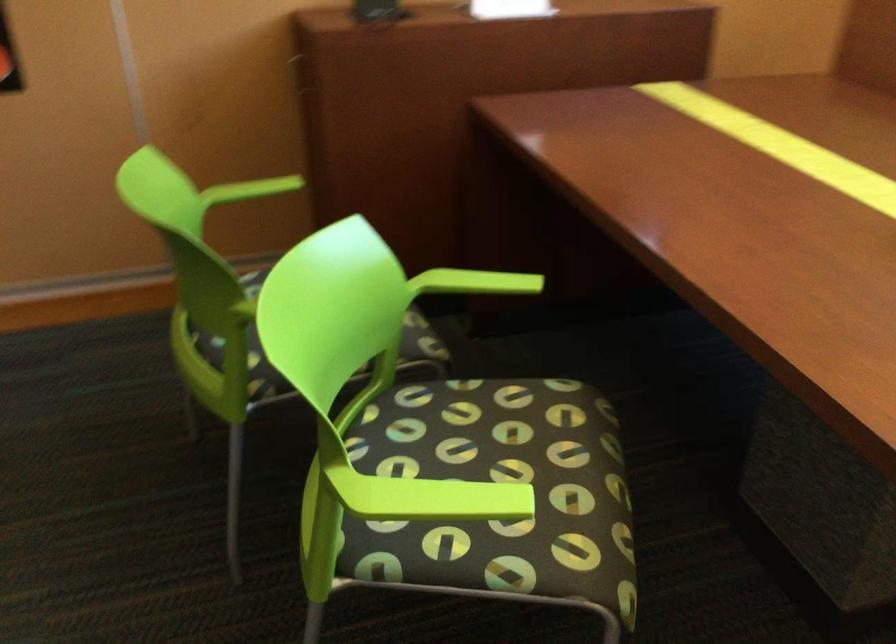
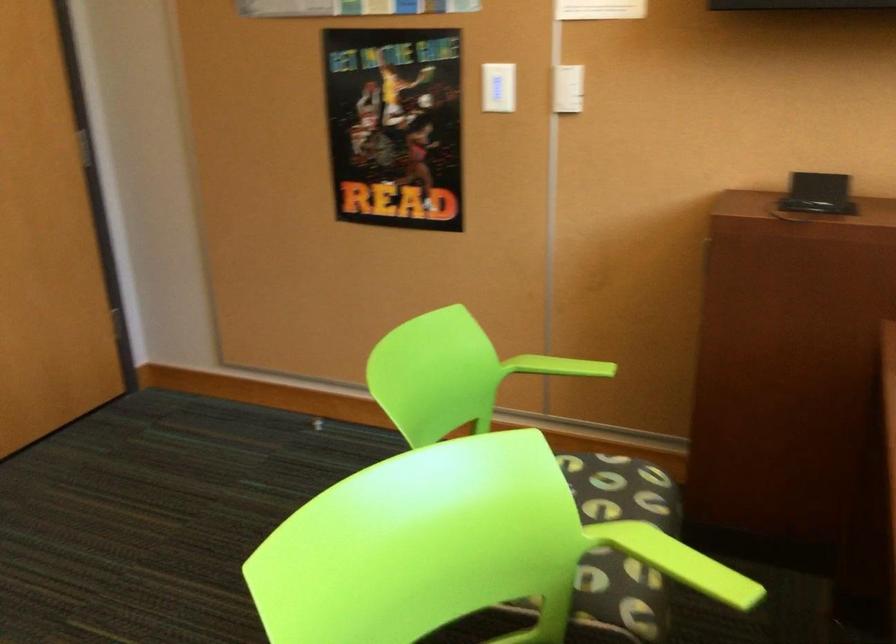
Locate, in the second image, the point that corresponds to (488,283) in the first image.

(685, 564)